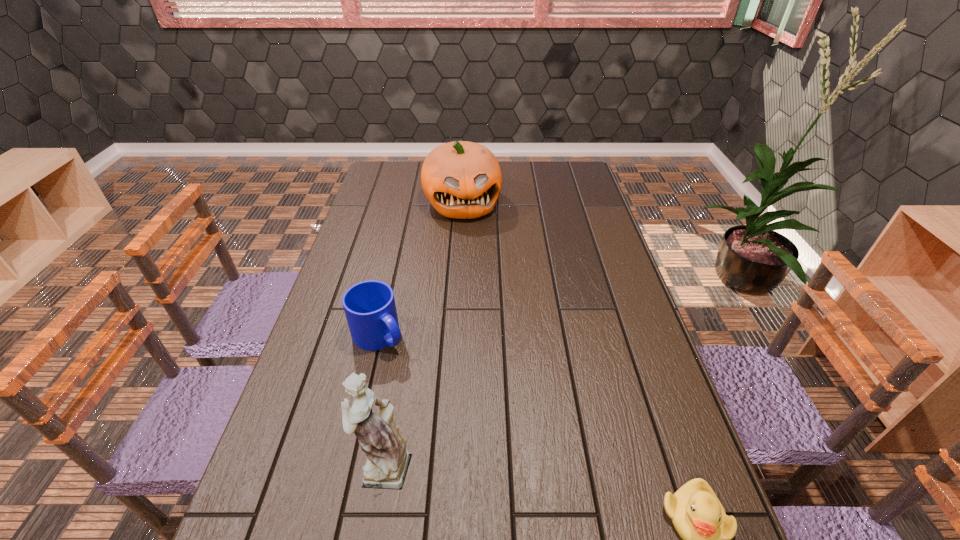
Locate an element on the screen. free space on the desktop that is between the tallest object and the shortest object and is positioned on the side with the handle of the third tallest object is located at coordinates (542, 492).

Locate an element on the screen. The image size is (960, 540). vacant spot on the desktop that is between the figurine and the shortest object and is positioned on the face of the farthest object is located at coordinates (544, 492).